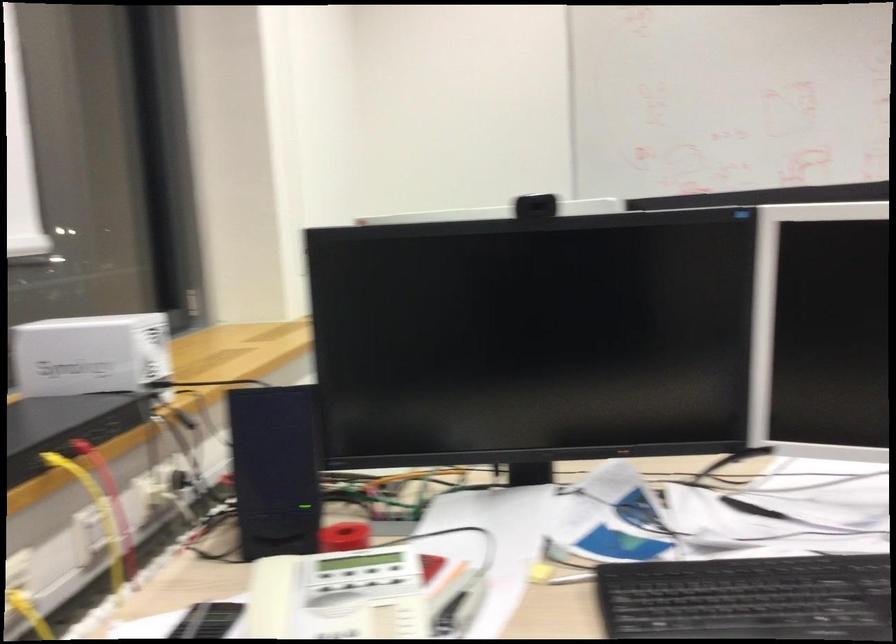
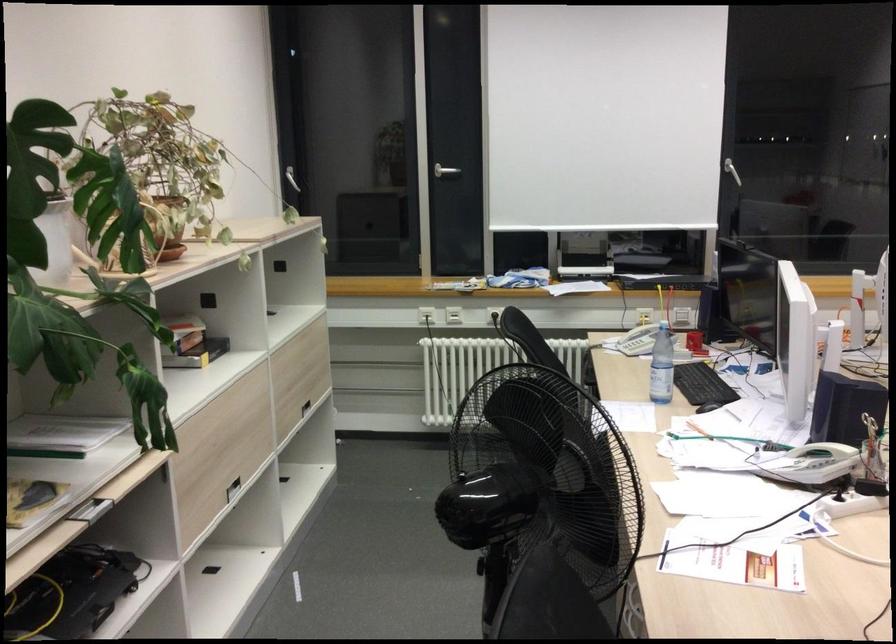
Where in the second image is the point corresponding to (375,558) from the first image?

(694, 343)